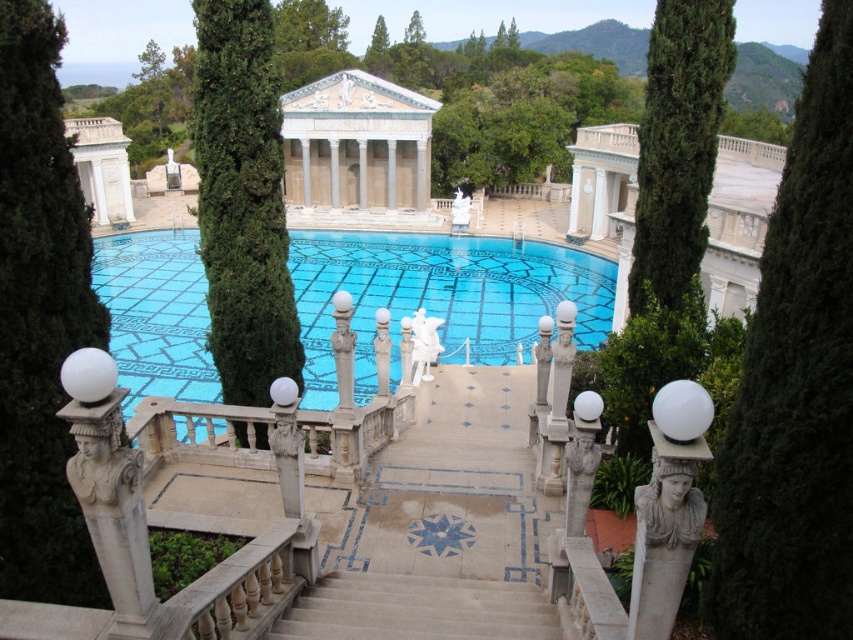
Question: Does green leafy tree at center appear over blue mosaic tiles at center?

Choices:
 (A) no
 (B) yes

Answer: (A)

Question: Which point is closer to the camera?

Choices:
 (A) green coniferous tree at upper center
 (B) green leafy tree at left
 (C) green textured tree at center

Answer: (B)

Question: Can you confirm if green leafy tree at center is positioned to the right of blue mosaic tiles at center?

Choices:
 (A) no
 (B) yes

Answer: (B)

Question: Which object is farther from the camera taking this photo?

Choices:
 (A) green leafy tree at center
 (B) green coniferous tree at upper center
 (C) white marble temple at center
 (D) blue mosaic tiles at center

Answer: (C)

Question: Estimate the real-world distances between objects in this image. Which object is farther from the white marble stairs at center?

Choices:
 (A) green leafy tree at left
 (B) blue mosaic tiles at center

Answer: (B)

Question: Does blue mosaic tiles at center appear over white marble temple at center?

Choices:
 (A) yes
 (B) no

Answer: (B)